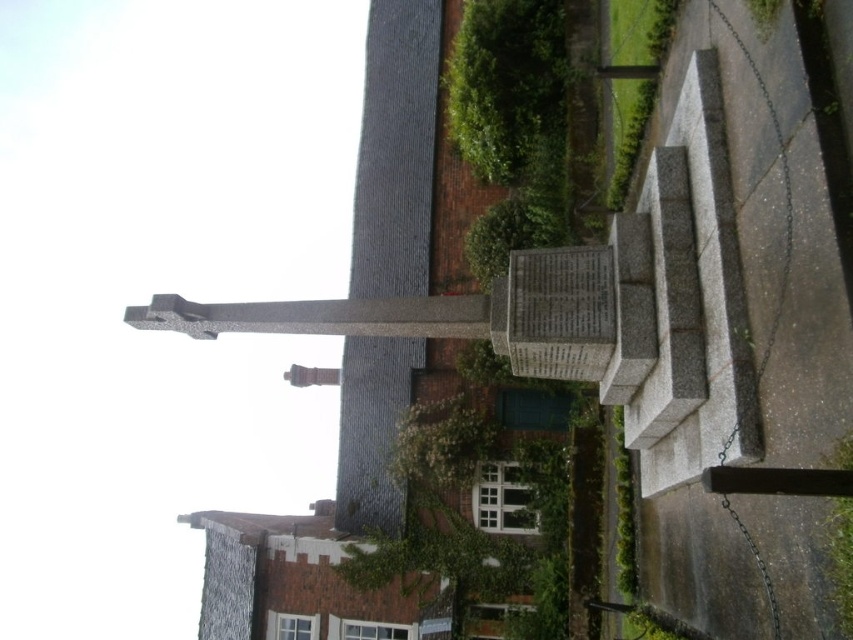
Question: Which point appears closest to the camera in this image?

Choices:
 (A) (527, 102)
 (B) (828, 572)

Answer: (B)

Question: Observing the image, what is the correct spatial positioning of green mossy stone at upper center in reference to green leafy plant at lower right?

Choices:
 (A) above
 (B) below

Answer: (A)

Question: Can you confirm if green mossy stone at upper center is bigger than green leafy plant at lower right?

Choices:
 (A) no
 (B) yes

Answer: (B)

Question: Which point appears farthest from the camera in this image?

Choices:
 (A) tap(849, 516)
 (B) tap(477, 92)

Answer: (B)

Question: Is green mossy stone at upper center below green leafy plant at lower right?

Choices:
 (A) yes
 (B) no

Answer: (B)